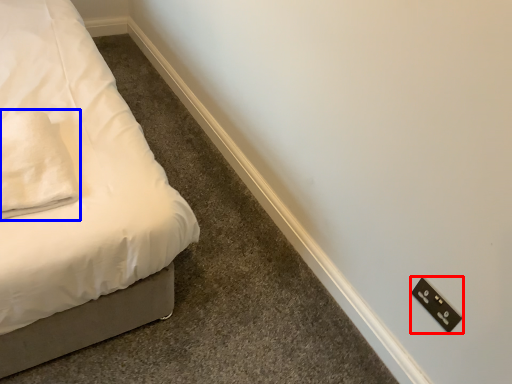
Question: Which object appears farthest to the camera in this image, light switch (highlighted by a red box) or pillow (highlighted by a blue box)?

Choices:
 (A) light switch
 (B) pillow

Answer: (A)